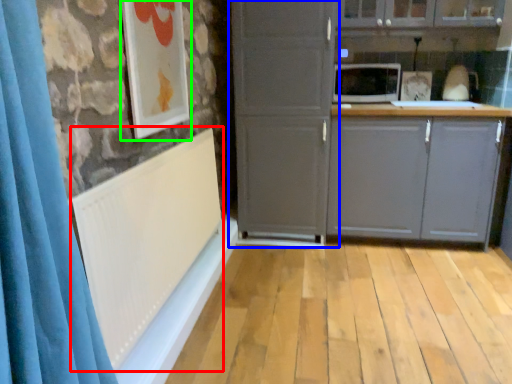
Question: Estimate the real-world distances between objects in this image. Which object is farther from radiator (highlighted by a red box), cupboard (highlighted by a blue box) or picture frame (highlighted by a green box)?

Choices:
 (A) cupboard
 (B) picture frame

Answer: (A)